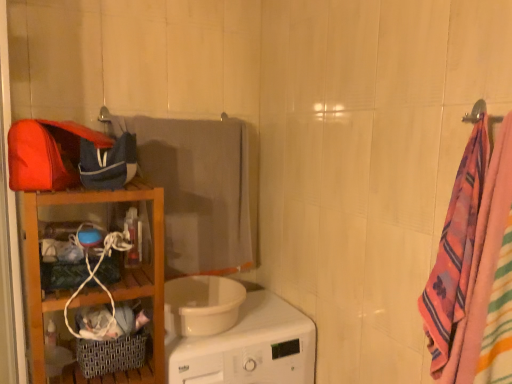
Question: Is white glossy washing machine at center at the left side of wooden shelf at left?

Choices:
 (A) yes
 (B) no

Answer: (B)

Question: Would you consider white glossy washing machine at center to be distant from wooden shelf at left?

Choices:
 (A) no
 (B) yes

Answer: (A)

Question: Considering the relative sizes of white glossy washing machine at center and wooden shelf at left in the image provided, is white glossy washing machine at center thinner than wooden shelf at left?

Choices:
 (A) yes
 (B) no

Answer: (B)

Question: Could you tell me if white glossy washing machine at center is facing wooden shelf at left?

Choices:
 (A) no
 (B) yes

Answer: (A)

Question: Is white glossy washing machine at center taller than wooden shelf at left?

Choices:
 (A) yes
 (B) no

Answer: (B)

Question: Is white glossy washing machine at center positioned in front of wooden shelf at left?

Choices:
 (A) yes
 (B) no

Answer: (A)

Question: Is multicolored woven towel at right, placed as the 2th beach towel when sorted from left to right, oriented towards wooden shelf at left?

Choices:
 (A) no
 (B) yes

Answer: (A)

Question: Is wooden shelf at left at the back of multicolored woven towel at right, the 1th beach towel from the front?

Choices:
 (A) yes
 (B) no

Answer: (B)

Question: Is multicolored woven towel at right, which is counted as the second beach towel, starting from the back, wider than wooden shelf at left?

Choices:
 (A) no
 (B) yes

Answer: (A)

Question: Considering the relative positions of multicolored woven towel at right, which is counted as the second beach towel, starting from the back, and wooden shelf at left in the image provided, is multicolored woven towel at right, which is counted as the second beach towel, starting from the back, behind wooden shelf at left?

Choices:
 (A) yes
 (B) no

Answer: (B)

Question: Considering the relative sizes of multicolored woven towel at right, which is the first beach towel from right to left, and wooden shelf at left in the image provided, is multicolored woven towel at right, which is the first beach towel from right to left, thinner than wooden shelf at left?

Choices:
 (A) no
 (B) yes

Answer: (B)

Question: Considering the relative positions of multicolored woven towel at right, which is the first beach towel from right to left, and wooden shelf at left in the image provided, is multicolored woven towel at right, which is the first beach towel from right to left, in front of wooden shelf at left?

Choices:
 (A) yes
 (B) no

Answer: (A)

Question: From the image's perspective, does multicolored woven towel at right, placed as the 2th beach towel when sorted from left to right, appear higher than gray fabric towel at center, the second beach towel from the front?

Choices:
 (A) yes
 (B) no

Answer: (B)